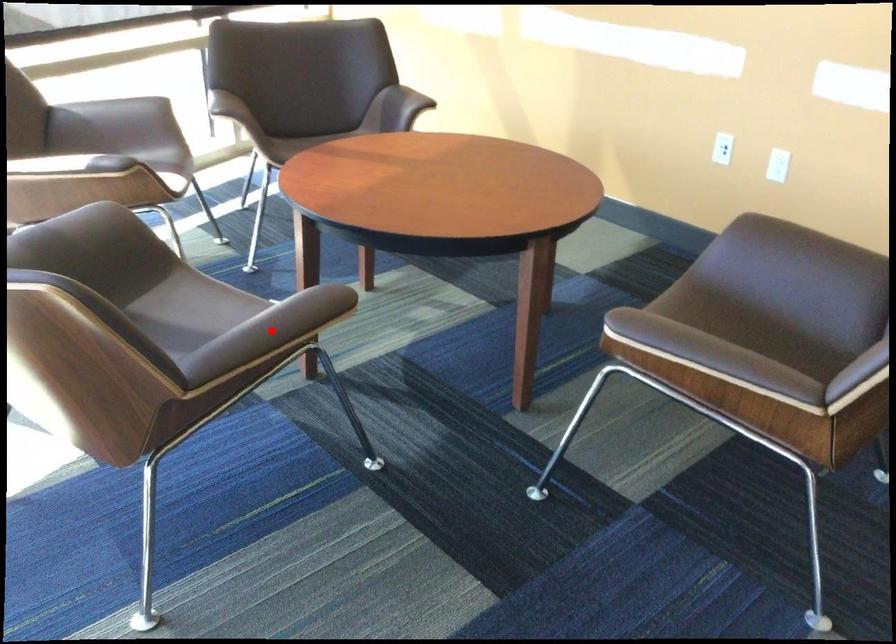
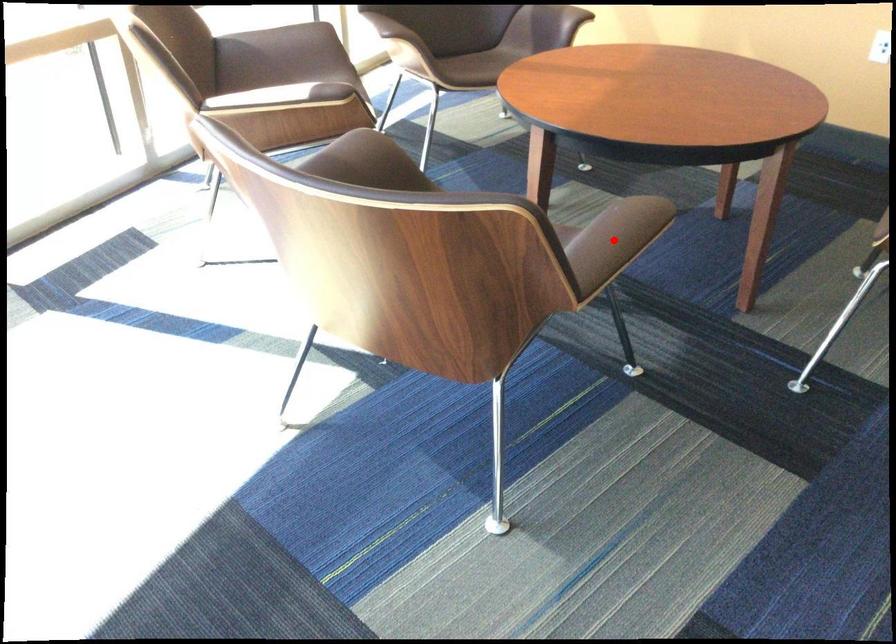
I am providing you with two images of the same scene from different viewpoints. A red point is marked on the first image and another point is marked on the second image. Are the points marked in image1 and image2 representing the same 3D position?

Yes